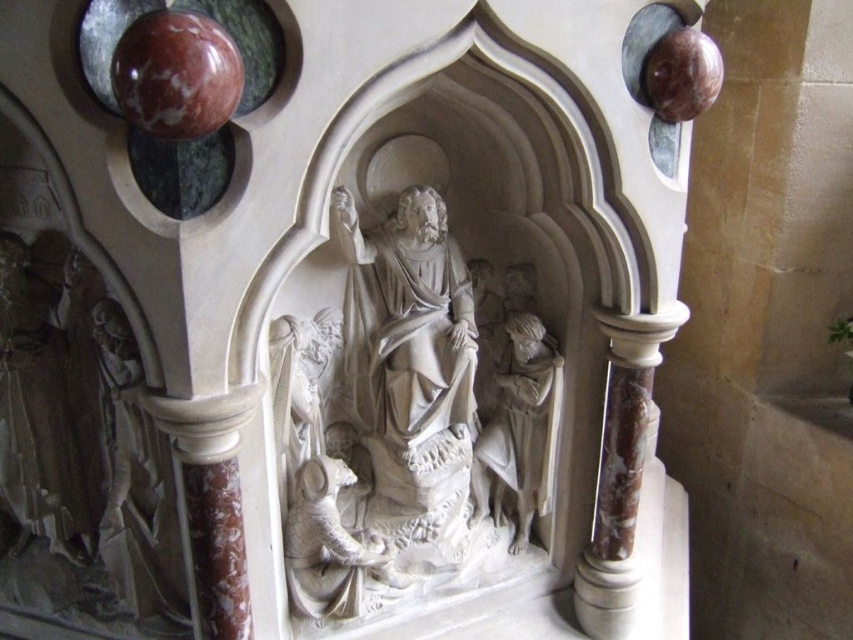
You are an art conservator examining the stone relief sculpture in the niche. You notice two central figures labeled as the white marble sculpture at center and the white marble statue at center. Which of these two figures is positioned closer to your viewpoint?

The white marble sculpture at center is closer to the viewer than the white marble statue at center.

Consider the image. You are an art conservator working on restoring the stone relief sculpture. You need to place a protective barrier between the white marble sculpture at center and the white marble statue at center. The barrier must be exactly 5 inches wide. Will the barrier fit between them without overlapping either object?

The distance between the white marble sculpture at center and the white marble statue at center is 4.77 inches. Since the barrier is 5 inches wide, which is wider than the space available, the barrier will overlap both objects.

In the image of the stone relief sculpture within the Gothic niche, there is a point labeled at coordinates (409, 420). What object in the scene is located at this specific coordinate?

The point at coordinates (409, 420) corresponds to the white marble sculpture at center.